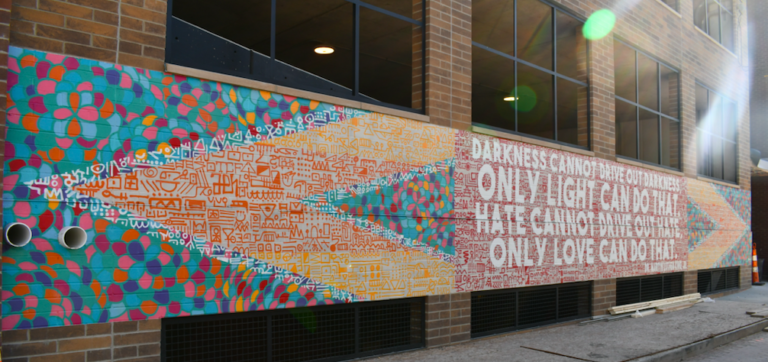
I want to click on lights, so click(326, 54), click(502, 99).